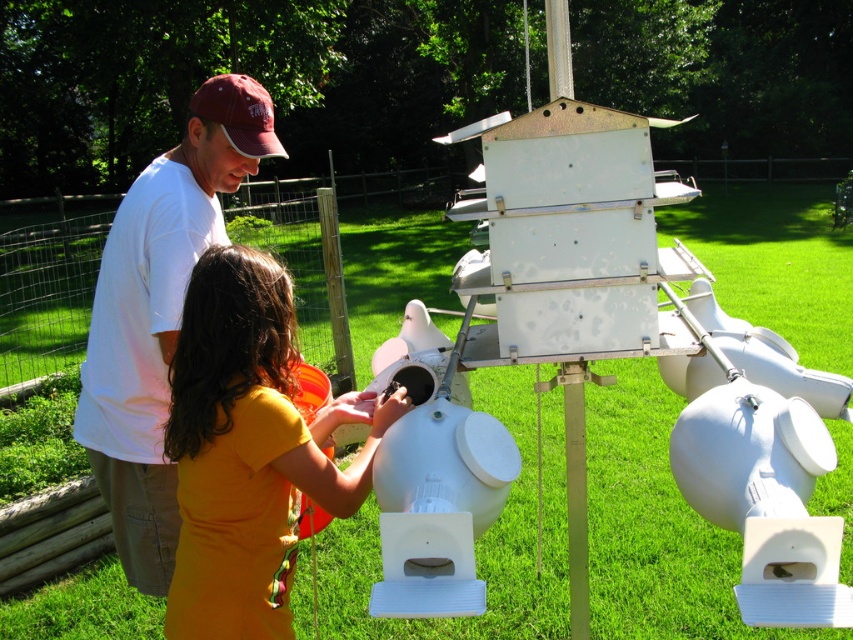
Where is the yellow matte shirt at center located in the image?

The yellow matte shirt at center is located at point 0.703 in the x coordinate and 0.293 in the y coordinate.

You are a photographer positioned at the center of the scene. You need to capture a photo that includes both the yellow matte shirt at center and the white matte shirt at upper left. Which direction should you move to ensure both are in frame?

The yellow matte shirt at center is located below the white matte shirt at upper left. To include both in the frame, you should move downward to capture the yellow matte shirt at center while keeping the white matte shirt at upper left in view.